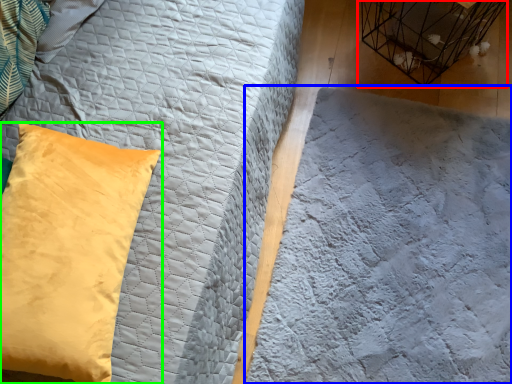
Question: Considering the real-world distances, which object is farthest from bird cage (highlighted by a red box)? sheet (highlighted by a blue box) or pillow (highlighted by a green box)?

Choices:
 (A) sheet
 (B) pillow

Answer: (B)